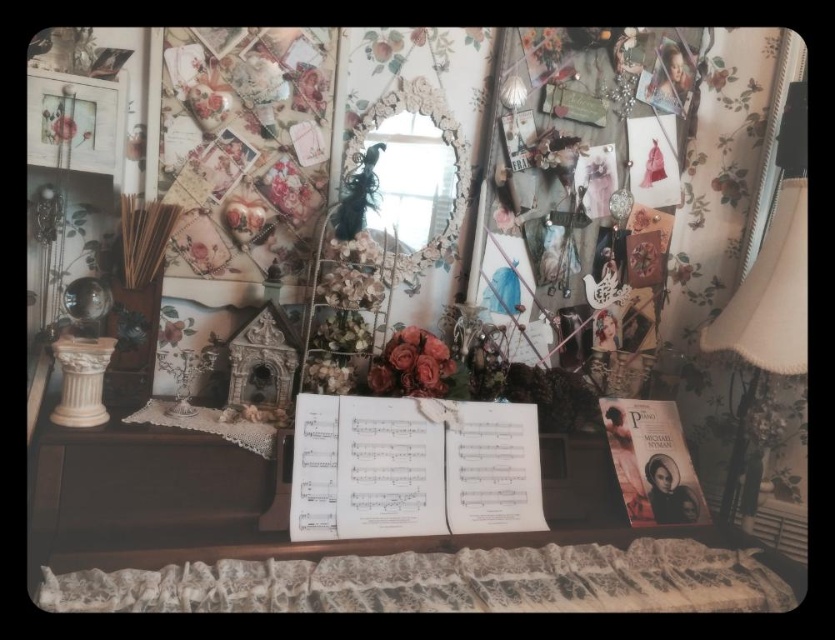
Does wooden table at center appear over matte pink roses at center?

No, wooden table at center is not above matte pink roses at center.

Locate an element on the screen. Image resolution: width=835 pixels, height=640 pixels. wooden table at center is located at coordinates (365, 536).

Does matte white picture frame at upper left appear on the left side of matte pink flower at upper left?

In fact, matte white picture frame at upper left is to the right of matte pink flower at upper left.

Who is more distant from viewer, (69, 115) or (69, 120)?

Point (69, 120)

Is point (97, 109) in front of point (68, 122)?

No, it is behind (68, 122).

Where is `matte white picture frame at upper left`? The width and height of the screenshot is (835, 640). matte white picture frame at upper left is located at coordinates (74, 122).

Is the position of wooden table at center less distant than that of matte white picture frame at upper left?

Yes, wooden table at center is in front of matte white picture frame at upper left.

Is point (585, 499) positioned before point (54, 131)?

No.

Who is more distant from viewer, (492, 573) or (102, 140)?

Point (102, 140)

The height and width of the screenshot is (640, 835). I want to click on wooden table at center, so click(x=365, y=536).